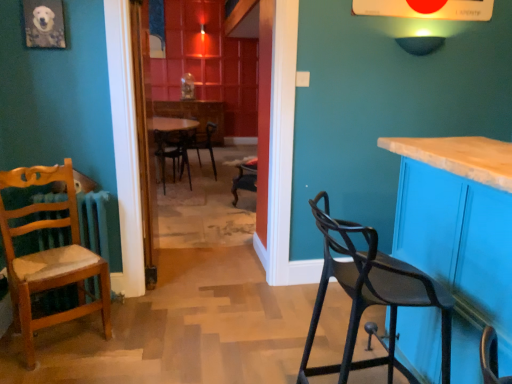
Find the location of `blank area beneath wooden table at center (from a real-world perspective)`. blank area beneath wooden table at center (from a real-world perspective) is located at coordinates (207, 281).